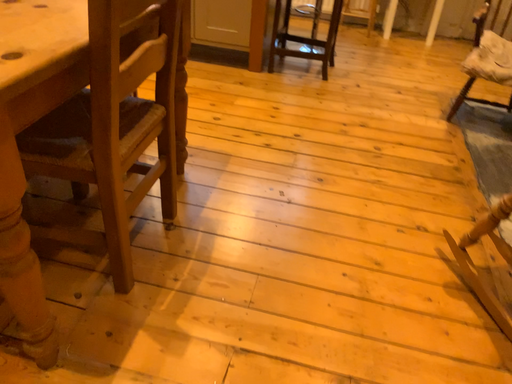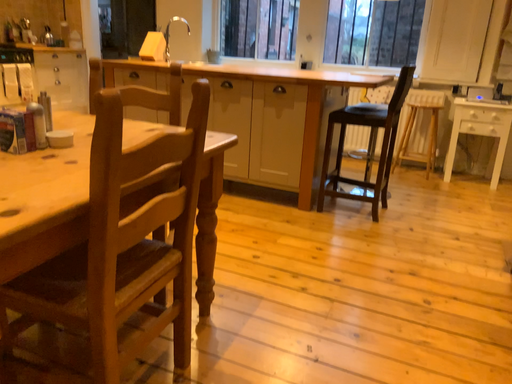
Question: Which way did the camera rotate in the video?

Choices:
 (A) rotated downward
 (B) rotated upward

Answer: (B)